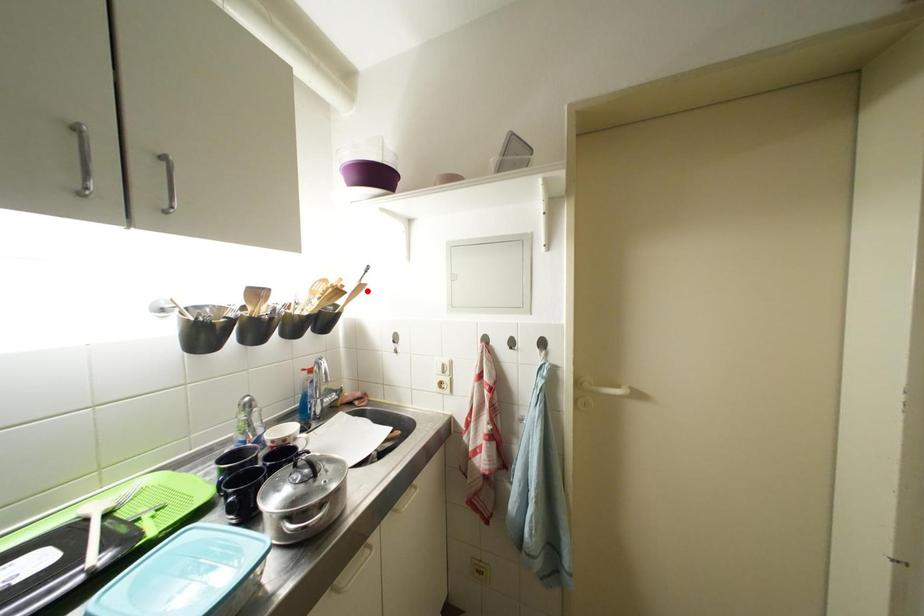
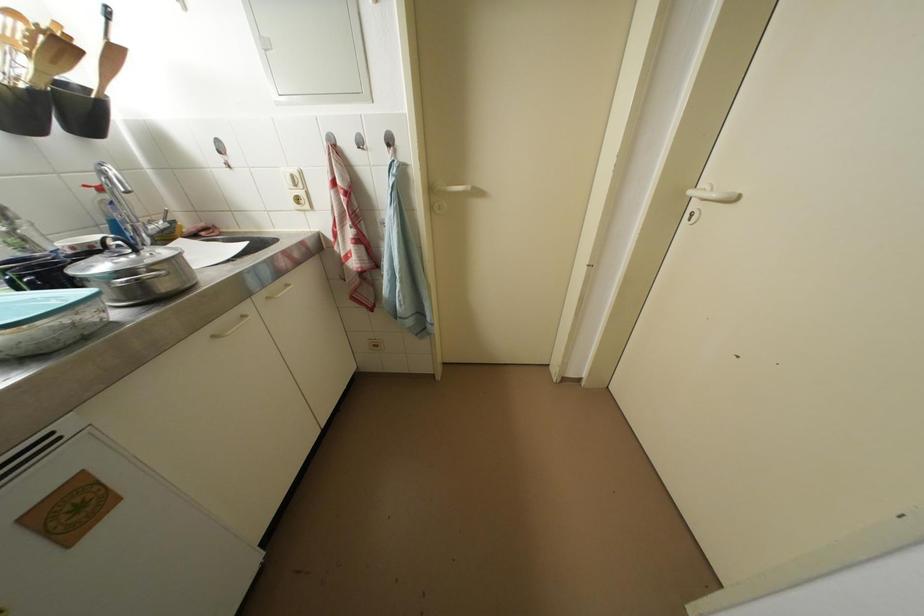
In the second image, find the point that corresponds to the highlighted location in the first image.

(120, 55)